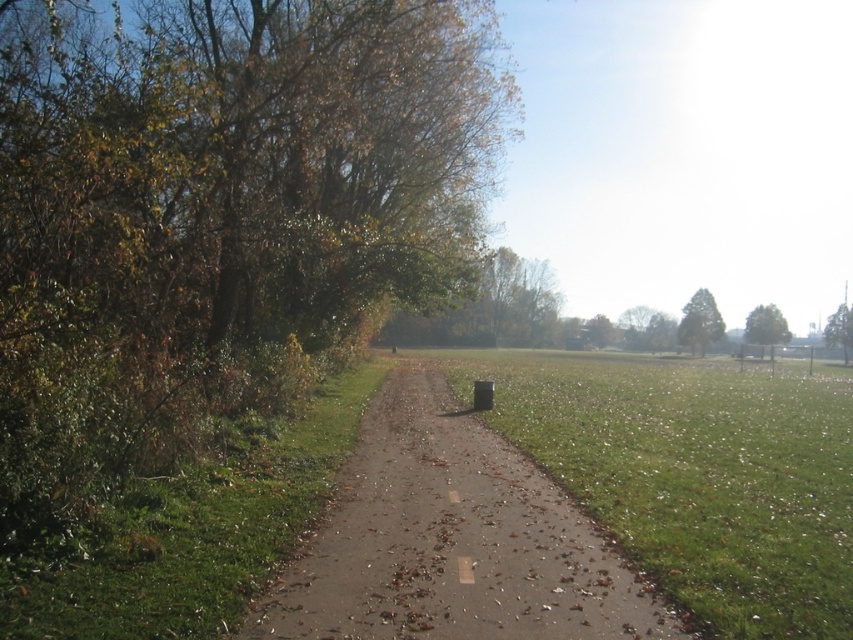
Question: Which object is closer to the camera taking this photo?

Choices:
 (A) green leafy tree at right
 (B) green leafy tree at upper right
 (C) green leafy tree at left

Answer: (C)

Question: Can you confirm if green leafy tree at left is positioned below green textured tree at upper right?

Choices:
 (A) no
 (B) yes

Answer: (A)

Question: Considering the real-world distances, which object is closest to the green leafy tree at upper right?

Choices:
 (A) green leafy tree at left
 (B) green leafy tree at right
 (C) green textured tree at upper right

Answer: (C)

Question: Is green leafy tree at upper right wider than green leafy tree at right?

Choices:
 (A) yes
 (B) no

Answer: (B)

Question: Among these points, which one is farthest from the camera?

Choices:
 (A) (368, 502)
 (B) (846, 314)

Answer: (B)

Question: Can you confirm if green textured tree at upper right is positioned to the left of green leafy tree at upper right?

Choices:
 (A) yes
 (B) no

Answer: (A)